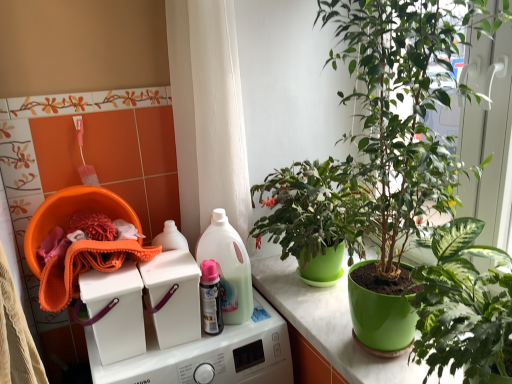
Find the location of `free space in front of white plastic washing machine at center, the 3th washing machine when ordered from bottom to top`. free space in front of white plastic washing machine at center, the 3th washing machine when ordered from bottom to top is located at coordinates (163, 357).